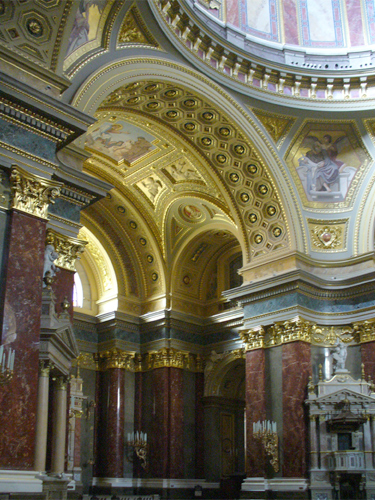
Where is `gold archway around window`? This screenshot has height=500, width=375. gold archway around window is located at coordinates (88, 236).